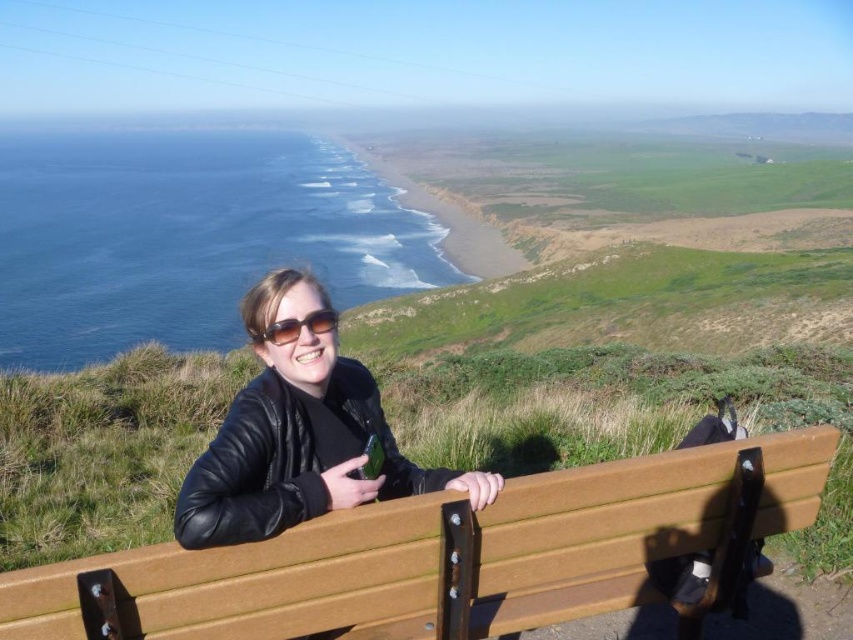
You are planning to set up a small picnic for two people. Given the sizes of the wooden bench at center and the green grassy shoreline at center, which location would be more suitable for spreading out a picnic blanket?

The green grassy shoreline at center is more suitable for spreading out a picnic blanket because the wooden bench at center has a smaller size compared to the green grassy shoreline at center.

You are standing at the edge of the cliff overlooking the coast. You see the wooden bench at center. If you want to walk directly towards the bench from your current position, which direction should you move in relation to the cliff edge?

Since the wooden bench at center is located at point (x=440, y=556), you should move towards the center of the image from the cliff edge to reach it.

You are a photographer trying to capture the entire green grassy shoreline at center and black matte sunglasses at center in a single frame. Which object should you focus on to ensure both are in the frame without cropping?

Since the green grassy shoreline at center is larger than the black matte sunglasses at center, you should focus on the green grassy shoreline at center to ensure both fit in the frame without cropping.